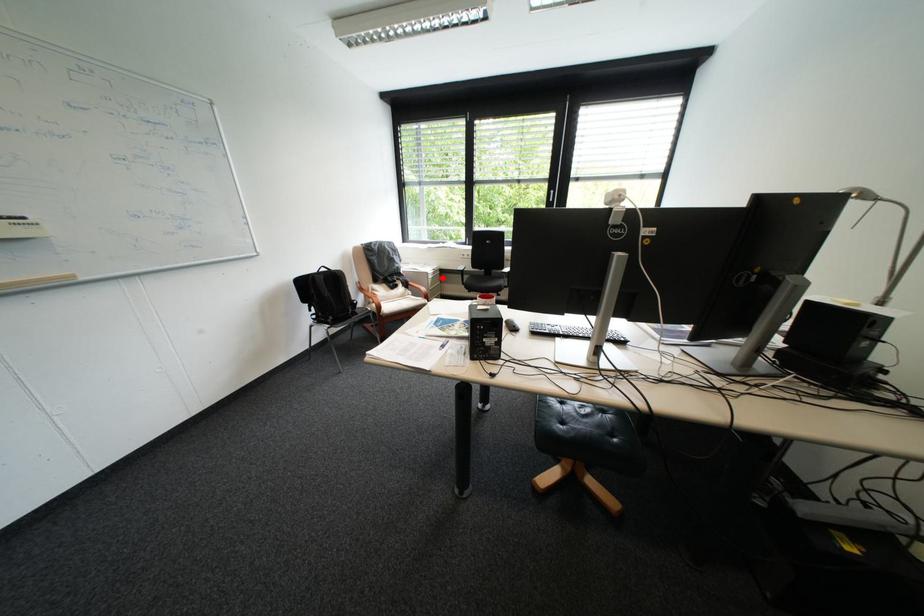
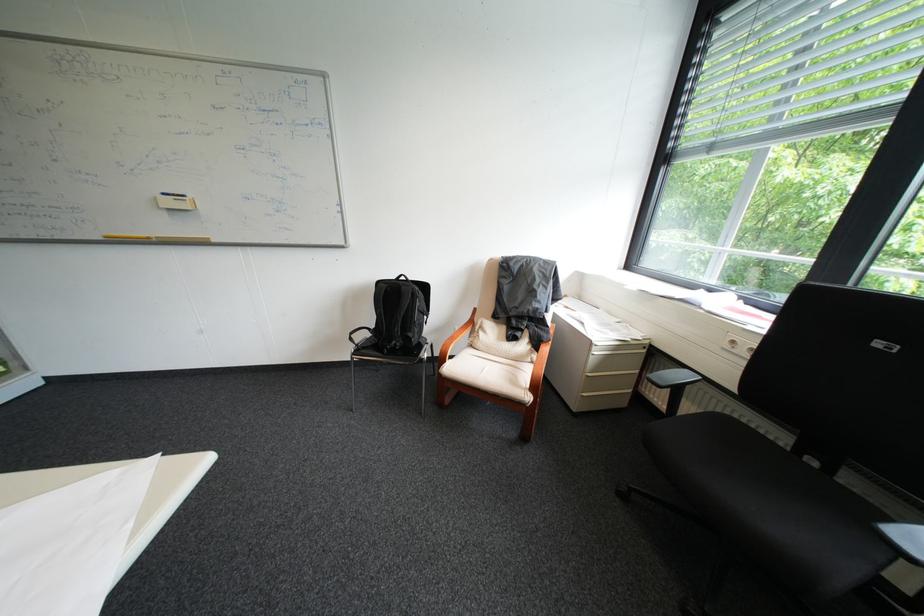
Locate, in the second image, the point that corresponds to the highlighted location in the first image.

(609, 353)